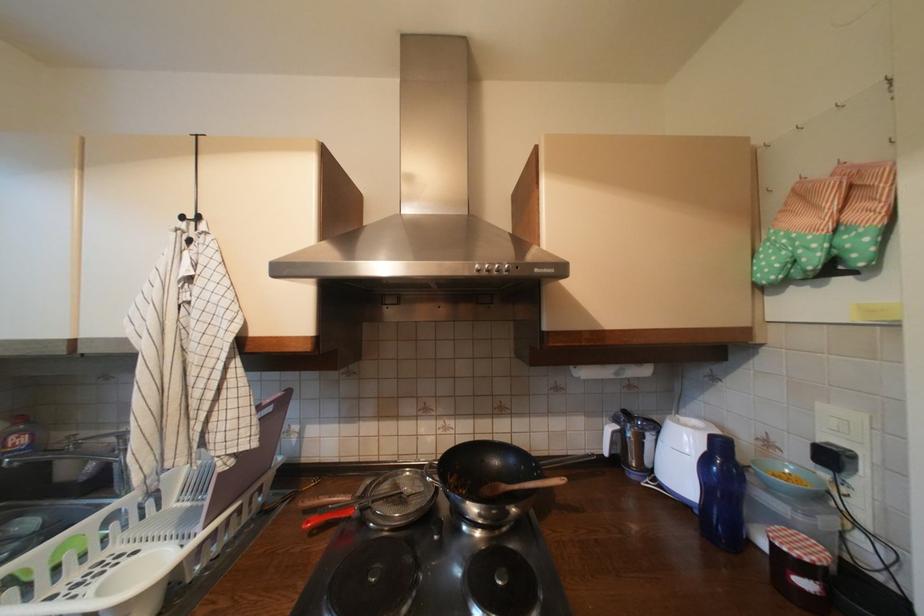
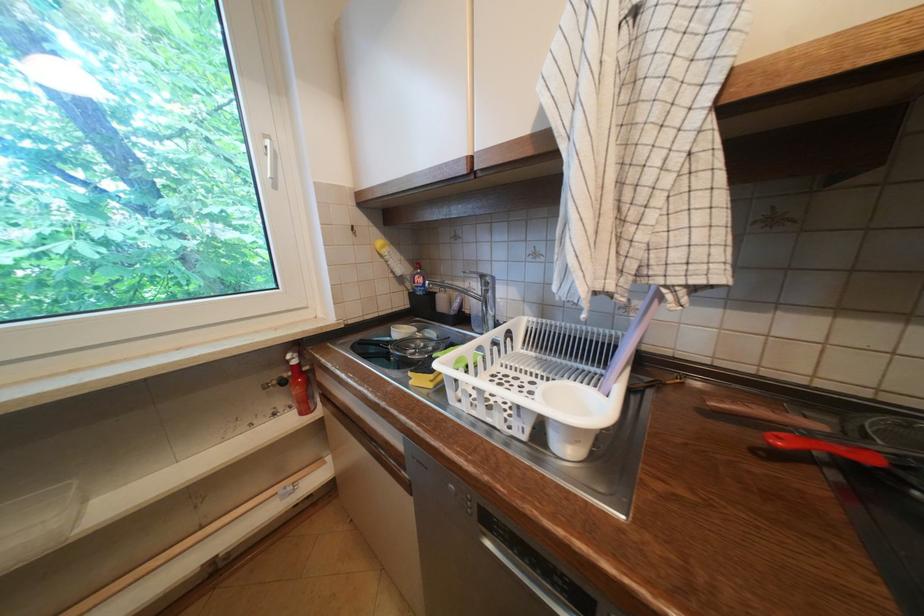
Where in the second image is the point corresponding to (317,524) from the first image?

(788, 440)